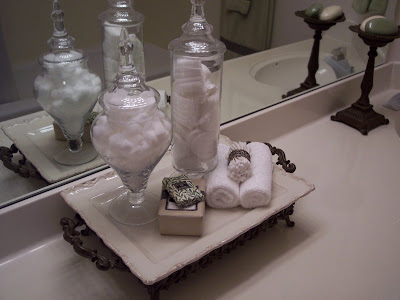
At what (x,y) coordinates should I click in order to perform the action: click on brown box with a dark brown ribbon. Please return your answer as a coordinate pair (x, y). This screenshot has width=400, height=300. Looking at the image, I should click on (193, 216).